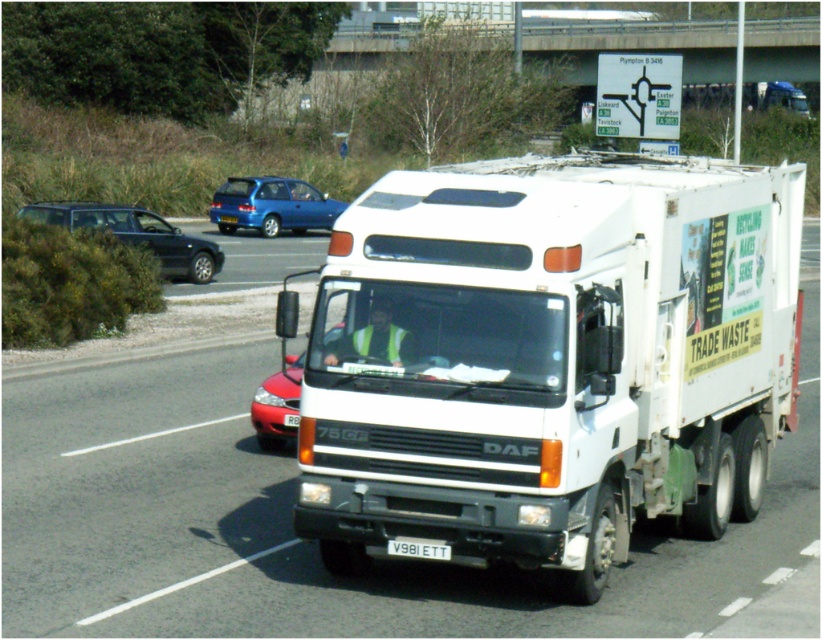
Question: Which point is closer to the camera?

Choices:
 (A) shiny black sedan at left
 (B) shiny red sedan at center
 (C) white plastic license plate at center

Answer: (C)

Question: Does shiny black sedan at left have a smaller size compared to shiny red sedan at center?

Choices:
 (A) no
 (B) yes

Answer: (A)

Question: Does metallic blue hatchback at upper center come in front of shiny red sedan at center?

Choices:
 (A) no
 (B) yes

Answer: (A)

Question: Is white matte truck at center smaller than shiny red sedan at center?

Choices:
 (A) yes
 (B) no

Answer: (B)

Question: Which of the following is the closest to the observer?

Choices:
 (A) (211, 269)
 (B) (412, 541)

Answer: (B)

Question: Among these points, which one is nearest to the camera?

Choices:
 (A) (289, 365)
 (B) (90, 211)
 (C) (432, 548)
 (D) (488, 497)

Answer: (D)